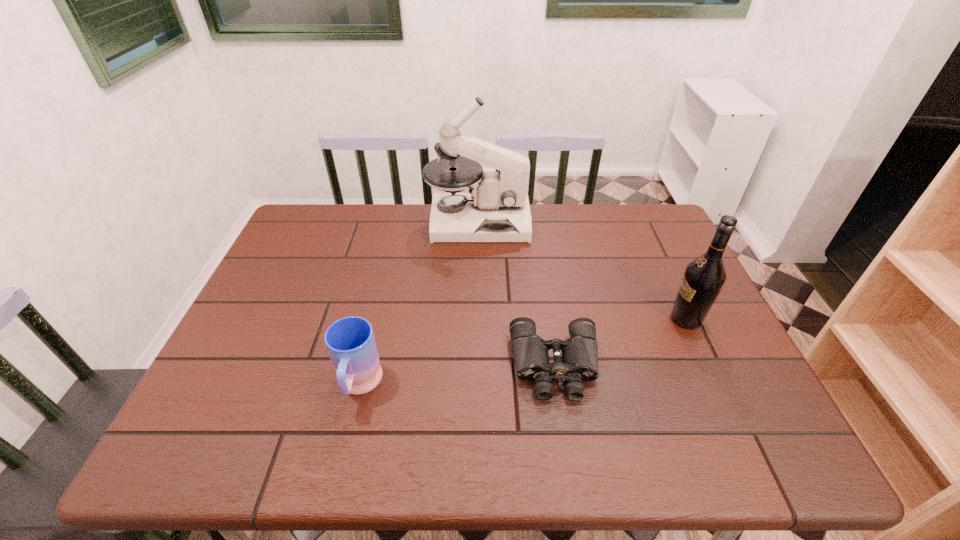
Where is `the tallest object`? This screenshot has height=540, width=960. the tallest object is located at coordinates (496, 209).

Where is `the farthest object`? the farthest object is located at coordinates (496, 209).

Locate an element on the screen. The width and height of the screenshot is (960, 540). the rightmost object is located at coordinates (704, 277).

Where is `the third shortest object`? the third shortest object is located at coordinates (704, 277).

This screenshot has width=960, height=540. I want to click on mug, so click(350, 341).

You are a GUI agent. You are given a task and a screenshot of the screen. Output one action in this format:
    pyautogui.click(x=<x>, y=<y>)
    Task: Click on the leftmost object
    Image resolution: width=960 pixels, height=540 pixels.
    Given the screenshot: What is the action you would take?
    pyautogui.click(x=350, y=341)

I want to click on the shortest object, so click(x=580, y=352).

The width and height of the screenshot is (960, 540). In order to click on free spot located at the eyepiece of the microscope in this screenshot , I will do `click(570, 222)`.

I want to click on vacant space located 0.390m on the label of the wine bottle, so click(x=516, y=319).

At what (x,y) coordinates should I click in order to perform the action: click on free space located on the label of the wine bottle. Please return your answer as a coordinate pair (x, y). Looking at the image, I should click on (524, 319).